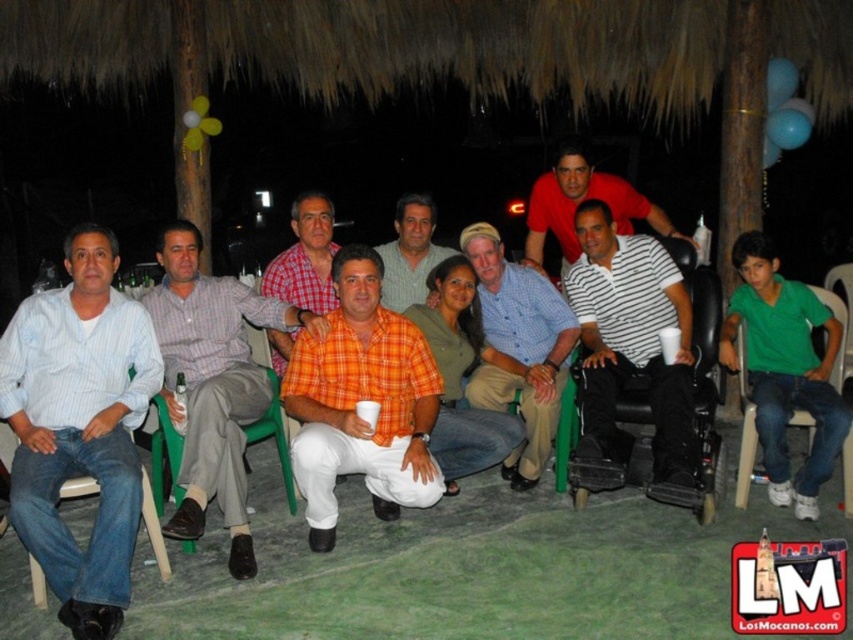
You are at a nighttime gathering under a thatched roof and need to sit down. You see an orange woven shirt at center and a white plastic chair at lower right. Which object is located above the other?

The orange woven shirt at center is positioned over the white plastic chair at lower right, so the shirt is above the chair.

You are at a party under a thatched roof and want to take a photo of the group. The white striped shirt at center and orange woven shirt at center are in your view. Which shirt should you focus on to ensure the other is still visible in the background?

The white striped shirt at center is in front of the orange woven shirt at center. To ensure the orange woven shirt at center is visible in the background, focus on the white striped shirt at center.

You are at the center of the image and want to locate the orange plaid shirt at center. Which direction should you look to find it?

The orange plaid shirt at center is located at point [363,400], so you should look slightly to the right and down from the center to find it.